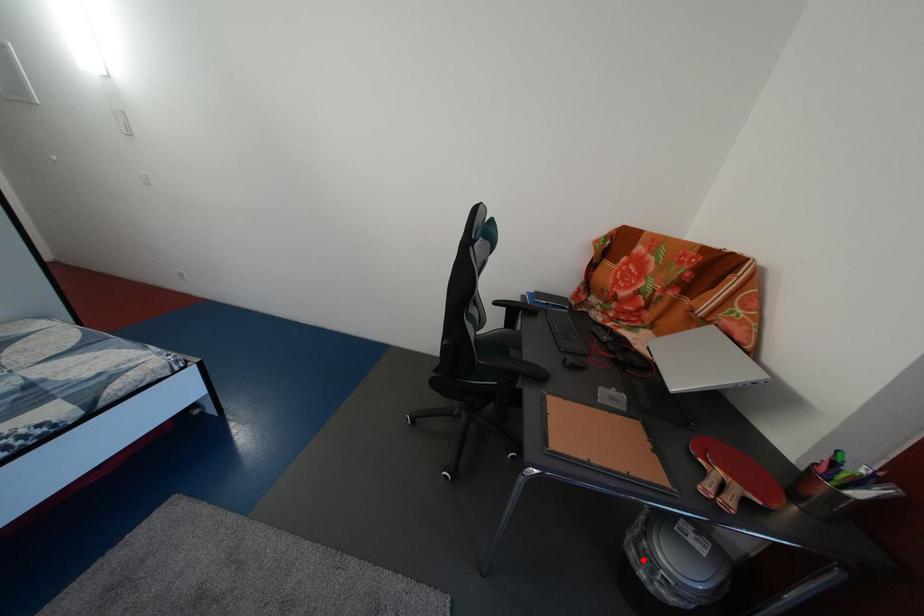
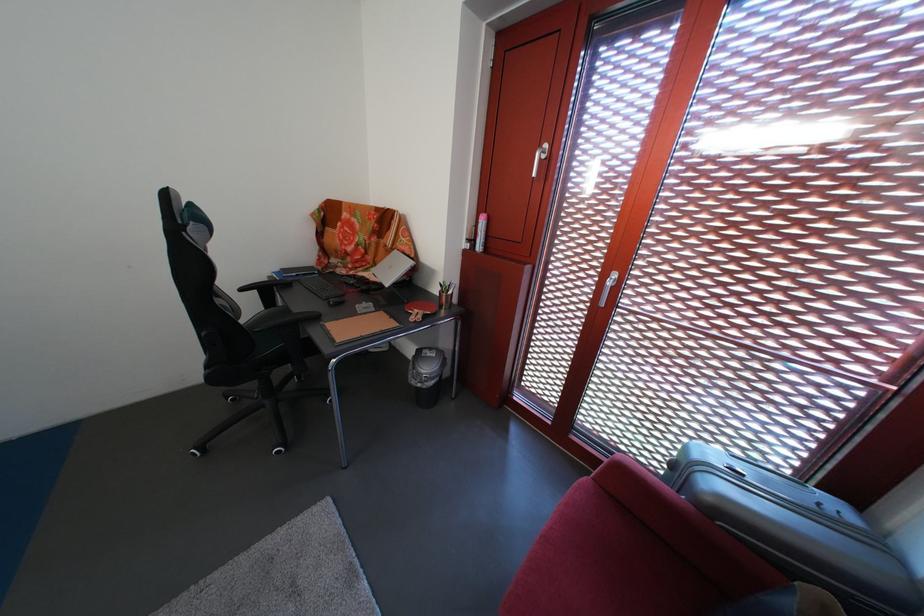
Locate, in the second image, the point that corresponds to the highlighted location in the first image.

(424, 389)